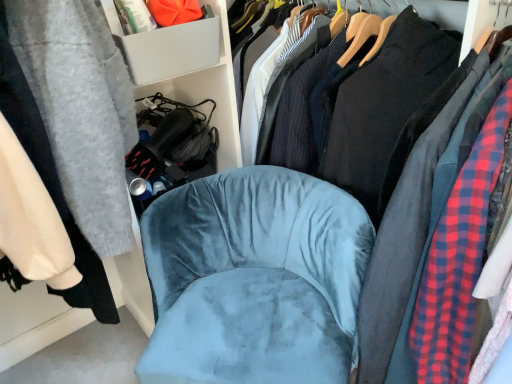
Question: Could you tell me if black cotton shirt at center is facing gray plastic storage bin at upper left?

Choices:
 (A) yes
 (B) no

Answer: (B)

Question: Are black cotton shirt at center and gray plastic storage bin at upper left beside each other?

Choices:
 (A) yes
 (B) no

Answer: (B)

Question: Is black cotton shirt at center to the left of gray plastic storage bin at upper left from the viewer's perspective?

Choices:
 (A) no
 (B) yes

Answer: (A)

Question: Does black cotton shirt at center have a greater width compared to gray plastic storage bin at upper left?

Choices:
 (A) no
 (B) yes

Answer: (B)

Question: Is the position of black cotton shirt at center less distant than that of gray plastic storage bin at upper left?

Choices:
 (A) yes
 (B) no

Answer: (A)

Question: Is black cotton shirt at center to the left or to the right of velvet blue chair at center in the image?

Choices:
 (A) left
 (B) right

Answer: (B)

Question: Is black cotton shirt at center wider or thinner than velvet blue chair at center?

Choices:
 (A) thin
 (B) wide

Answer: (B)

Question: Is black cotton shirt at center taller or shorter than velvet blue chair at center?

Choices:
 (A) tall
 (B) short

Answer: (A)

Question: Considering the positions of black cotton shirt at center and velvet blue chair at center in the image, is black cotton shirt at center bigger or smaller than velvet blue chair at center?

Choices:
 (A) small
 (B) big

Answer: (B)

Question: Looking at their shapes, would you say velvet blue chair at center is wider or thinner than black cotton shirt at center?

Choices:
 (A) wide
 (B) thin

Answer: (B)

Question: From a real-world perspective, is velvet blue chair at center above or below black cotton shirt at center?

Choices:
 (A) above
 (B) below

Answer: (B)

Question: From the image's perspective, relative to black cotton shirt at center, is velvet blue chair at center above or below?

Choices:
 (A) below
 (B) above

Answer: (A)

Question: From their relative heights in the image, would you say velvet blue chair at center is taller or shorter than black cotton shirt at center?

Choices:
 (A) tall
 (B) short

Answer: (B)

Question: In terms of width, does velvet blue chair at center look wider or thinner when compared to gray plastic storage bin at upper left?

Choices:
 (A) wide
 (B) thin

Answer: (A)

Question: Considering the positions of velvet blue chair at center and gray plastic storage bin at upper left in the image, is velvet blue chair at center bigger or smaller than gray plastic storage bin at upper left?

Choices:
 (A) small
 (B) big

Answer: (B)